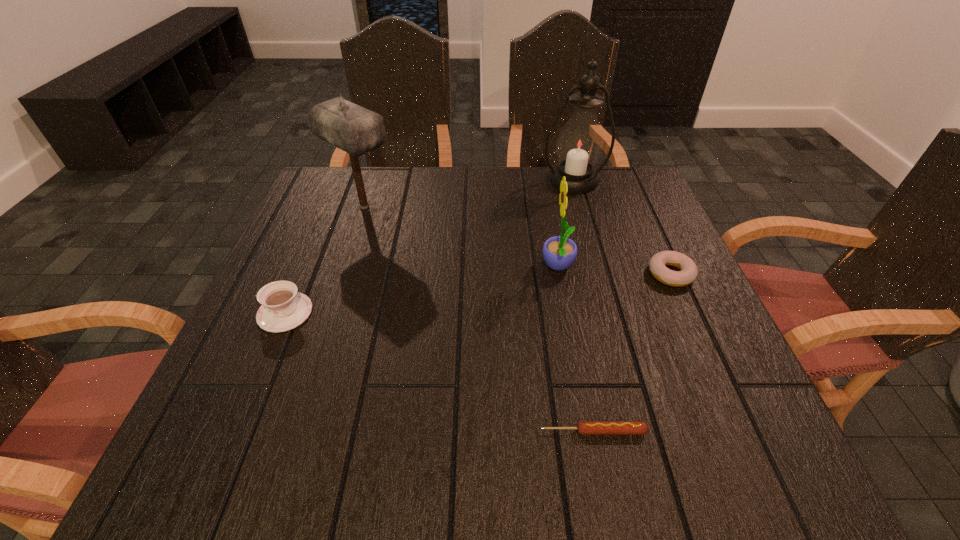
The height and width of the screenshot is (540, 960). Identify the location of vacant area that lies between the teacup and the mallet. (324, 260).

You are a GUI agent. You are given a task and a screenshot of the screen. Output one action in this format:
    pyautogui.click(x=<x>, y=<y>)
    Task: Click on the object identified as the fourth closest to the doughnut
    The width and height of the screenshot is (960, 540).
    Given the screenshot: What is the action you would take?
    pyautogui.click(x=356, y=130)

Locate an element on the screen. This screenshot has width=960, height=540. the third closest object to the shortest object is located at coordinates (283, 308).

Find the location of `free space that satisfies the following two spatial constraints: 1. on the front-facing side of the sausage; 2. on the left side of the sunflower`. free space that satisfies the following two spatial constraints: 1. on the front-facing side of the sausage; 2. on the left side of the sunflower is located at coordinates (588, 431).

Where is `free spot that satisfies the following two spatial constraints: 1. on the front side of the oil lamp; 2. on the handle side of the fourth tallest object`? Image resolution: width=960 pixels, height=540 pixels. free spot that satisfies the following two spatial constraints: 1. on the front side of the oil lamp; 2. on the handle side of the fourth tallest object is located at coordinates (612, 313).

At what (x,y) coordinates should I click in order to perform the action: click on free space that satisfies the following two spatial constraints: 1. on the front-facing side of the shortest object; 2. on the right side of the sunflower. Please return your answer as a coordinate pair (x, y). This screenshot has width=960, height=540. Looking at the image, I should click on (588, 431).

Find the location of `free spot that satisfies the following two spatial constraints: 1. on the front-facing side of the rightmost object; 2. on the left side of the third tallest object`. free spot that satisfies the following two spatial constraints: 1. on the front-facing side of the rightmost object; 2. on the left side of the third tallest object is located at coordinates (560, 274).

What are the coordinates of `free spot that satisfies the following two spatial constraints: 1. on the handle side of the fifth farthest object; 2. on the left side of the nearest object` in the screenshot? It's located at (235, 431).

Where is `free region that satisfies the following two spatial constraints: 1. on the front-facing side of the fourth shortest object; 2. on the right side of the shortest object`? The width and height of the screenshot is (960, 540). free region that satisfies the following two spatial constraints: 1. on the front-facing side of the fourth shortest object; 2. on the right side of the shortest object is located at coordinates (588, 431).

This screenshot has width=960, height=540. In order to click on blank space that satisfies the following two spatial constraints: 1. on the back side of the nearest object; 2. on the front-facing side of the third tallest object in this screenshot , I will do `click(562, 267)`.